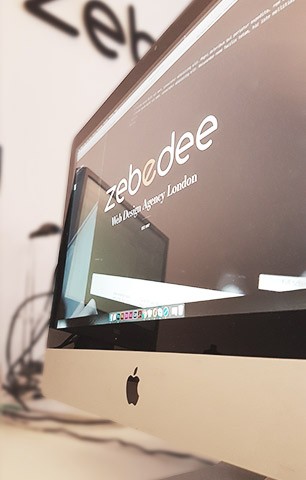
Where is `black monitor`? Image resolution: width=306 pixels, height=480 pixels. black monitor is located at coordinates (243, 83).